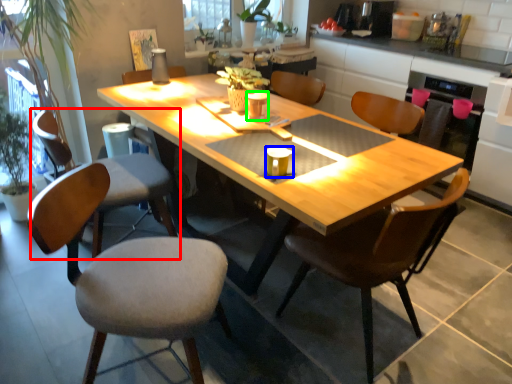
Question: Which object is positioned closest to chair (highlighted by a red box)? Select from coffee cup (highlighted by a blue box) and coffee cup (highlighted by a green box).

Choices:
 (A) coffee cup
 (B) coffee cup

Answer: (B)